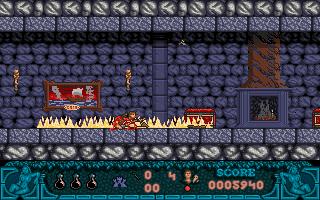
The width and height of the screenshot is (320, 200). I want to click on chest, so click(207, 118).